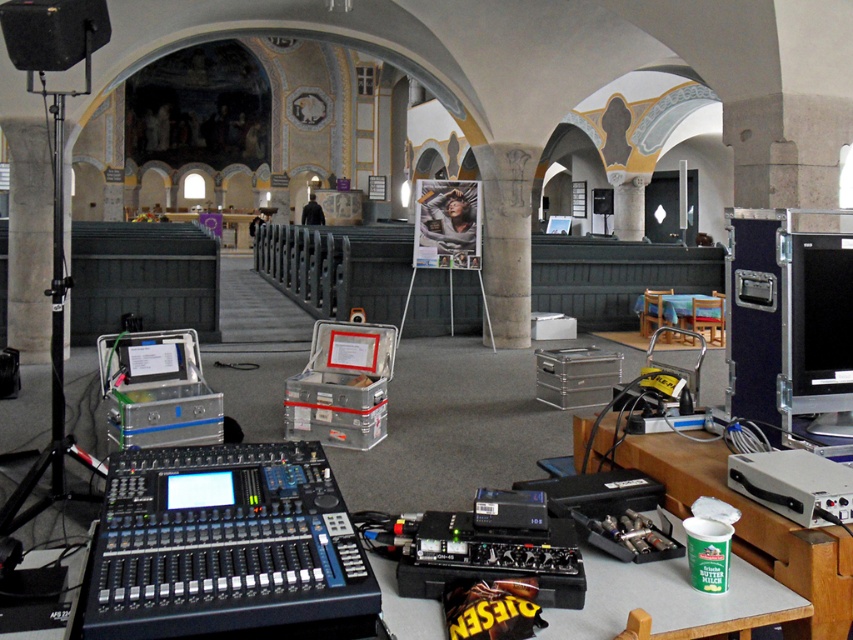
Based on the photo, you are a technician carrying a 16 inch wide cable box. You need to move from the black plastic mixing console at center to the metallic gray table at lower right. Can the cable box fit through the space between them?

The space between the black plastic mixing console at center and metallic gray table at lower right is 17.72 inches. Since the cable box is 16 inches wide, it can fit through the space between them.

You are setting up equipment in the church and need to move the white plastic cup at lower right to a safer location. Which direction should you move it so it doesn not interfere with the black plastic mixing console at center?

The black plastic mixing console at center is in front of the white plastic cup at lower right. To move the white plastic cup at lower right away from the console, you should move it backward, away from the console, so it doesn not obstruct the area in front of it.